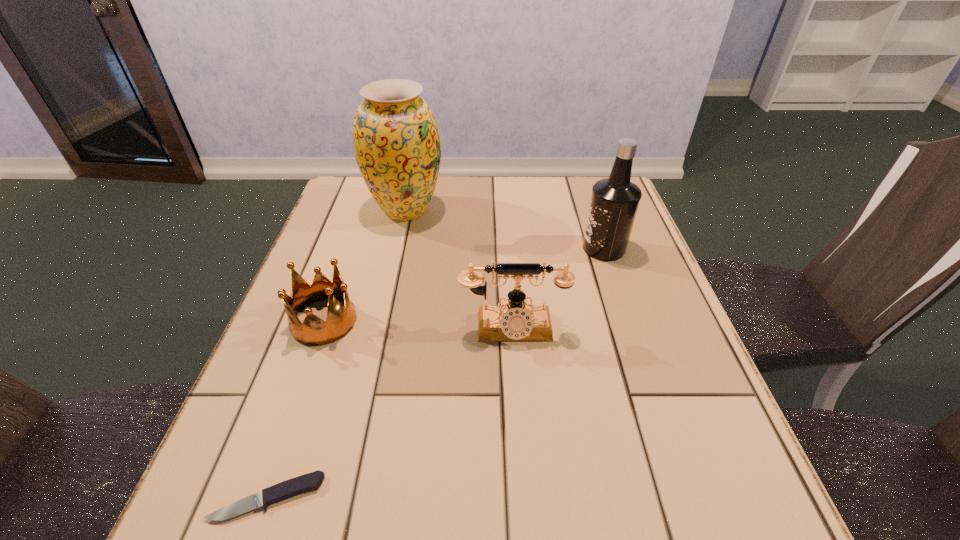
Identify the location of object present at the right edge. The width and height of the screenshot is (960, 540). (614, 202).

Identify the location of object that is at the far left corner. The height and width of the screenshot is (540, 960). (396, 141).

This screenshot has height=540, width=960. I want to click on object that is positioned at the near left corner, so click(x=311, y=481).

Where is `vacant space at the far edge of the desktop`? Image resolution: width=960 pixels, height=540 pixels. vacant space at the far edge of the desktop is located at coordinates (438, 191).

Find the location of a particular element. This screenshot has height=540, width=960. vacant space at the near edge is located at coordinates (524, 502).

In the image, there is a desktop. Identify the location of vacant area at the left edge. This screenshot has width=960, height=540. (236, 424).

You are a GUI agent. You are given a task and a screenshot of the screen. Output one action in this format:
    pyautogui.click(x=<x>, y=<y>)
    Task: Click on the vacant space at the right edge of the desktop
    This screenshot has height=540, width=960.
    Given the screenshot: What is the action you would take?
    pyautogui.click(x=653, y=435)

This screenshot has height=540, width=960. What are the coordinates of `vacant space at the near left corner` in the screenshot? It's located at (305, 510).

This screenshot has height=540, width=960. In the image, there is a desktop. Identify the location of vacant space at the far right corner. (x=578, y=177).

Identify the location of vacant space at the near right corner of the desktop. Image resolution: width=960 pixels, height=540 pixels. (690, 535).